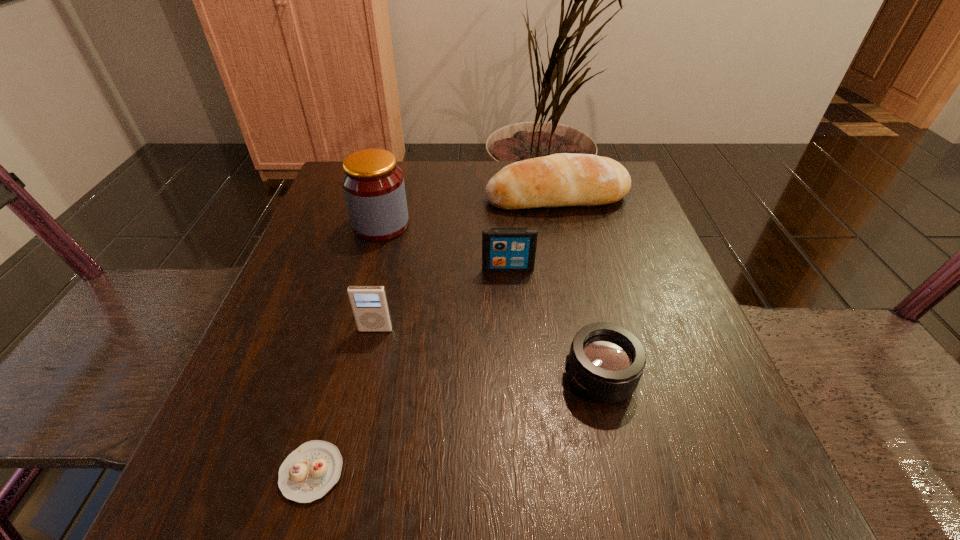
You are a GUI agent. You are given a task and a screenshot of the screen. Output one action in this format:
    pyautogui.click(x=<x>, y=<y>)
    Task: Click on the vacant space located on the right of the tallest object
    
    Given the screenshot: What is the action you would take?
    point(534,225)

The width and height of the screenshot is (960, 540). Find the location of `free space located on the back of the bread`. free space located on the back of the bread is located at coordinates (548, 161).

Identify the location of vacant region located 0.120m on the front-facing side of the nearer iPod. The image size is (960, 540). pos(361,395).

Where is `free space located on the front screen of the fourth nearest object`? This screenshot has width=960, height=540. free space located on the front screen of the fourth nearest object is located at coordinates (518, 420).

Find the location of a particular element. The image size is (960, 540). vacant area situated 0.140m on the side of the fifth tallest object with brand markings and control switches is located at coordinates (472, 377).

This screenshot has height=540, width=960. In order to click on blank space located on the side of the fifth tallest object with brand markings and control switches in this screenshot , I will do `click(459, 377)`.

I want to click on free space located 0.160m on the side of the fifth tallest object with brand markings and control switches, so click(459, 377).

The height and width of the screenshot is (540, 960). I want to click on free space located on the right of the nearest object, so (389, 472).

In order to click on jar that is positioned at the far edge in this screenshot , I will do `click(373, 184)`.

Locate an element on the screen. bread that is at the far edge is located at coordinates (564, 179).